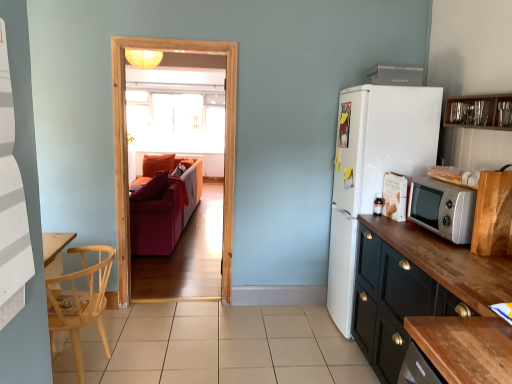
The height and width of the screenshot is (384, 512). I want to click on blank space situated above beige tile at center (from a real-world perspective), so click(215, 334).